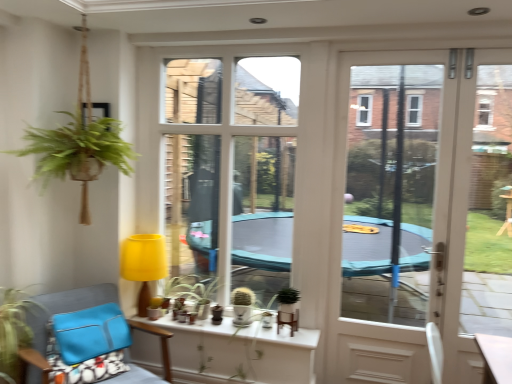
Question: From the image's perspective, is blue fabric chair at lower left located above or below green matte plant at lower left, arranged as the 1th houseplant when viewed from the front?

Choices:
 (A) below
 (B) above

Answer: (A)

Question: In terms of size, does blue fabric chair at lower left appear bigger or smaller than green matte plant at lower left, arranged as the 1th houseplant when viewed from the front?

Choices:
 (A) big
 (B) small

Answer: (A)

Question: Estimate the real-world distances between objects in this image. Which object is closer to the blue fabric chair at lower left?

Choices:
 (A) matte white cactus at center, which is the first houseplant in right-to-left order
 (B) matte yellow lampshade at center
 (C) white glass door at right
 (D) white ceramic pots at center
 (E) transparent plastic window screen at center

Answer: (B)

Question: Estimate the real-world distances between objects in this image. Which object is farther from the green matte plant at lower left, the second houseplant viewed from the right?

Choices:
 (A) transparent plastic window screen at center
 (B) blue fabric chair at lower left
 (C) white ceramic pots at center
 (D) green matte plant at center
 (E) matte yellow lampshade at center

Answer: (A)